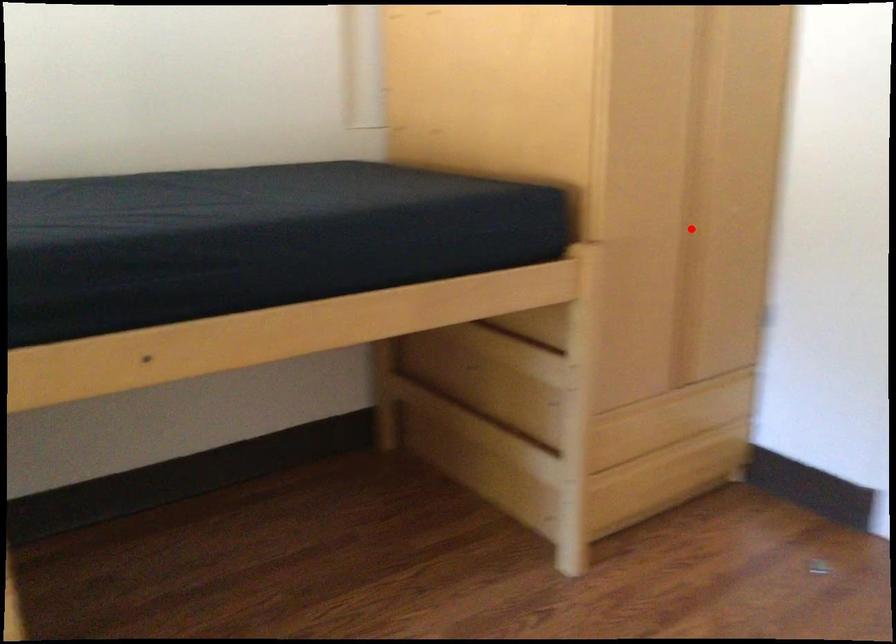
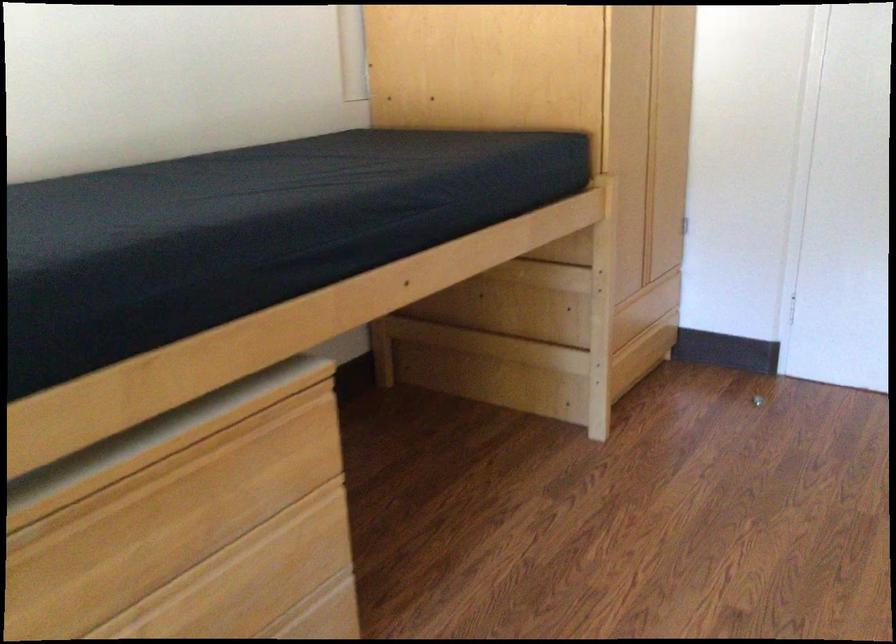
Find the pixel in the second image that matches the highlighted location in the first image.

(648, 160)